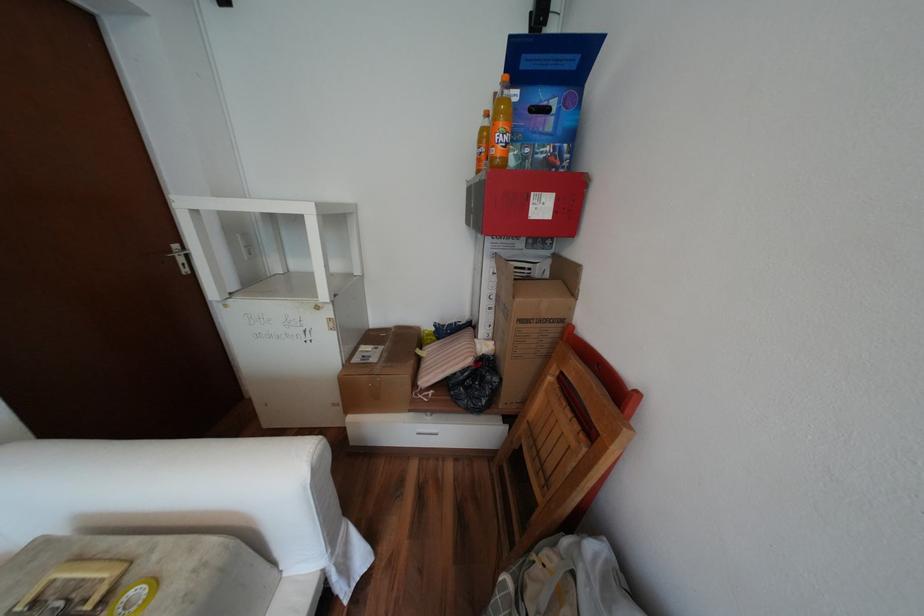
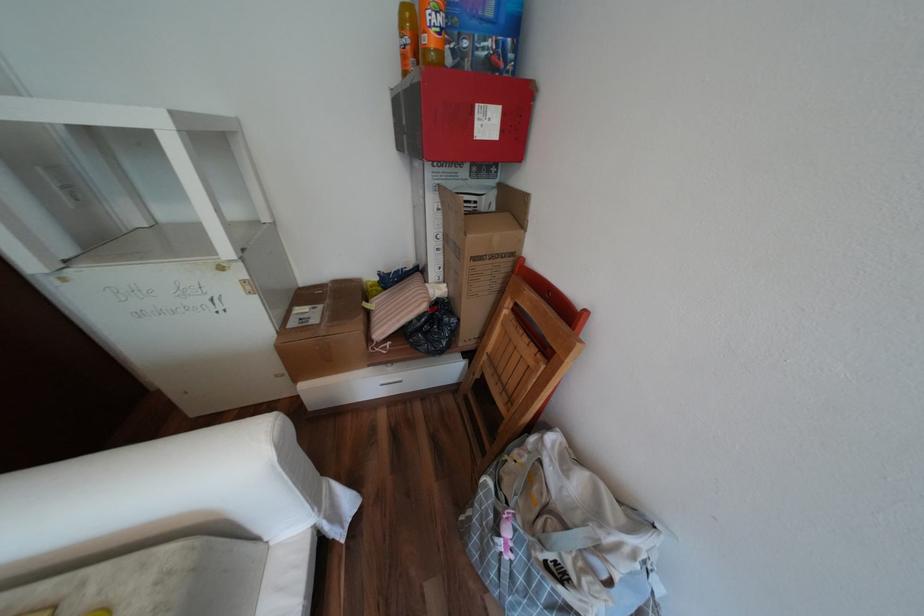
Which direction would the cameraman need to move to produce the second image?

The movement direction of the cameraman is left, forward.